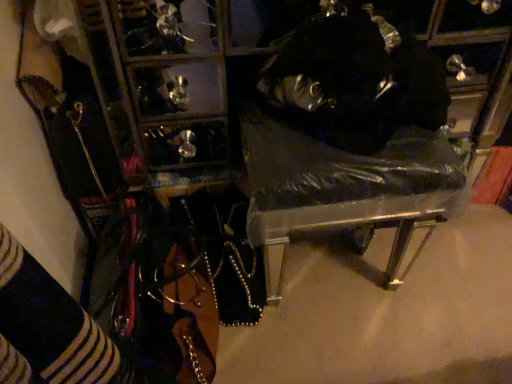
Identify the location of free space underneath clear plastic bag at center (from a real-world perspective). The width and height of the screenshot is (512, 384). (332, 271).